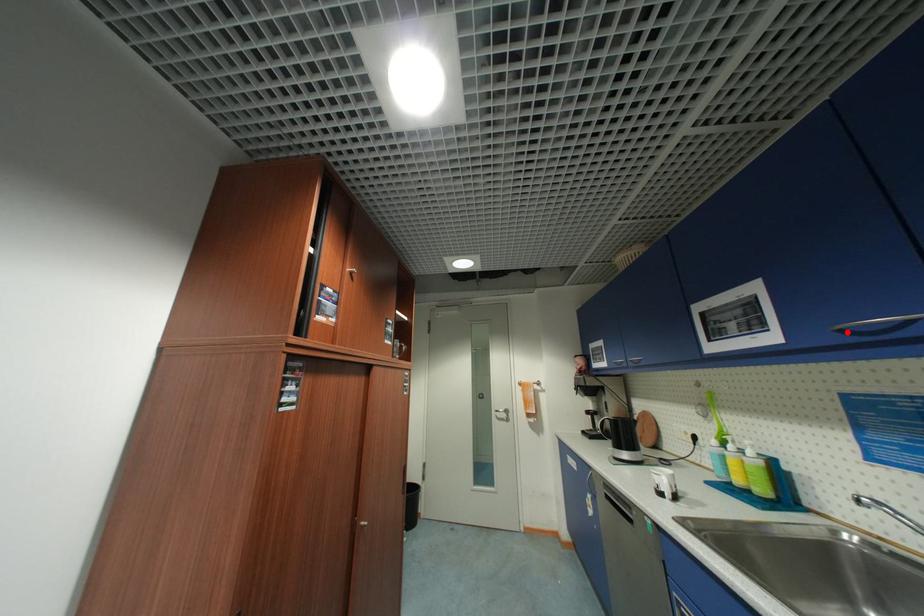
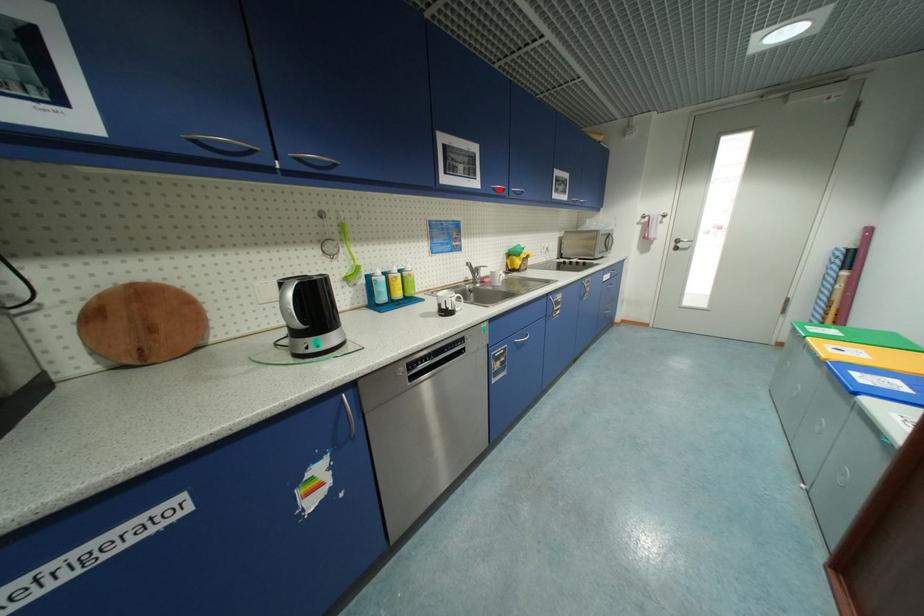
I am providing you with two images of the same scene from different viewpoints. A red point is marked on the first image and another point is marked on the second image. Is the marked point in image1 the same physical position as the marked point in image2?

Yes